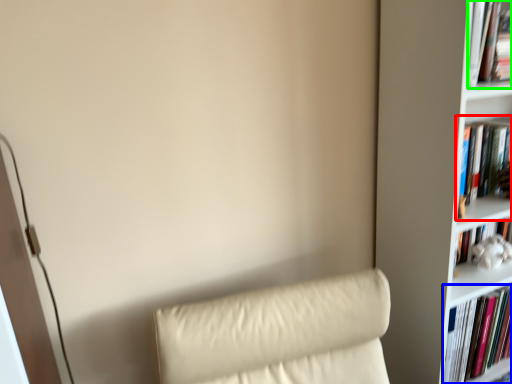
Question: Which object is the farthest from book (highlighted by a red box)? Choose among these: book (highlighted by a blue box) or book (highlighted by a green box).

Choices:
 (A) book
 (B) book

Answer: (A)